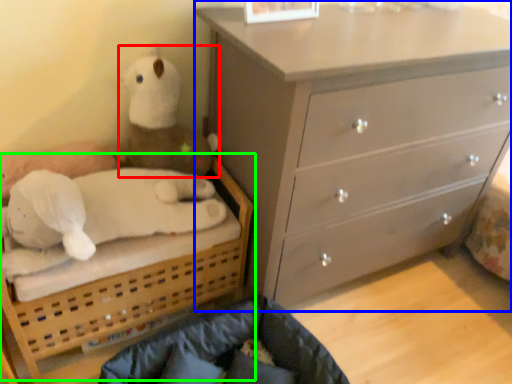
Question: Which object is positioned closest to toy (highlighted by a red box)? Select from chest of drawers (highlighted by a blue box) and bed (highlighted by a green box).

Choices:
 (A) chest of drawers
 (B) bed

Answer: (B)